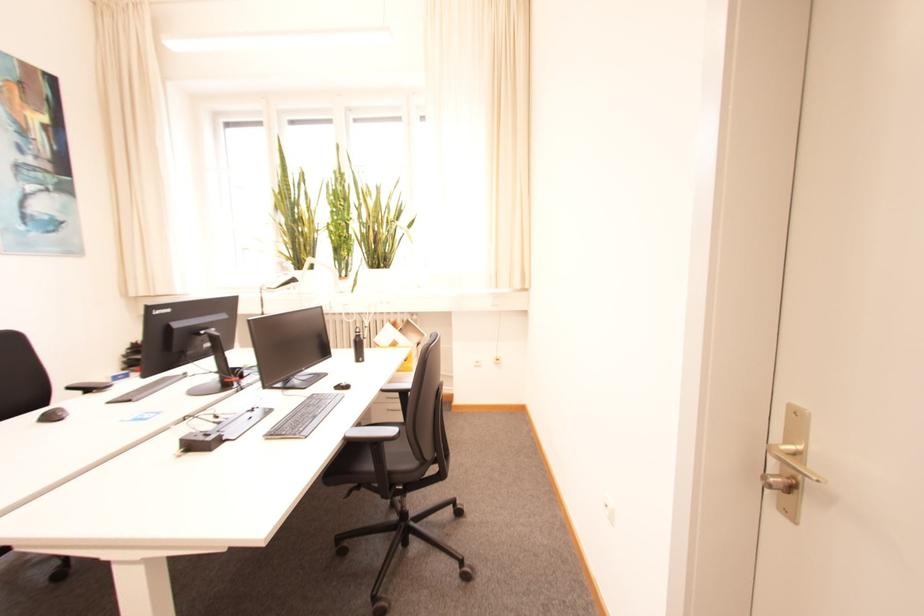
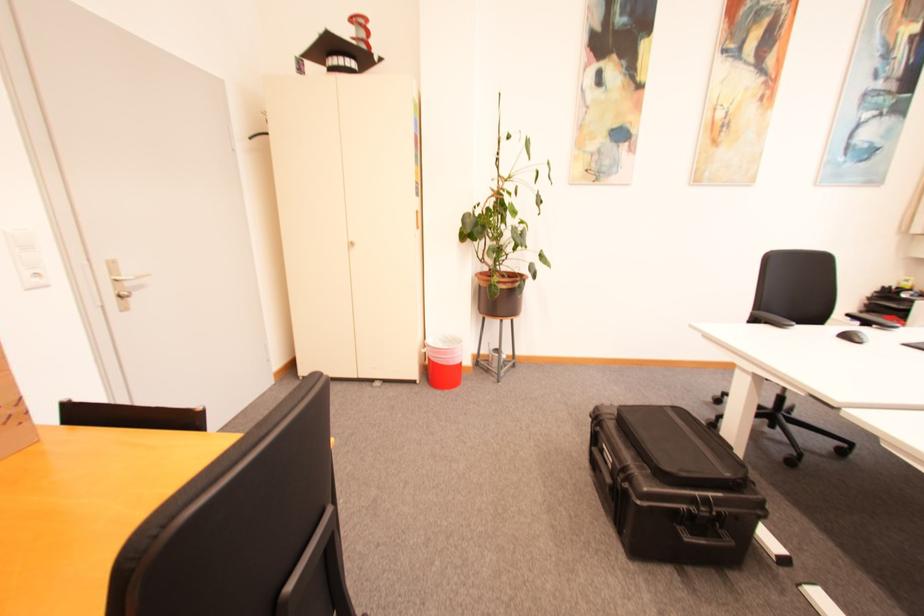
Based on the continuous images, in which direction is the camera rotating?

The camera's rotation is toward left-down.